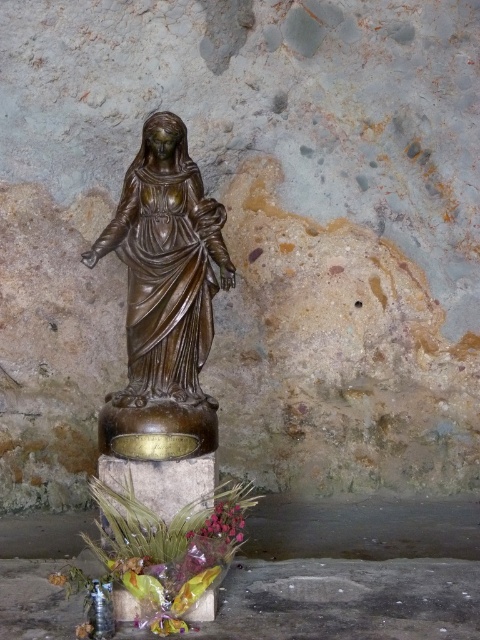
You are a maintenance worker inspecting the statue. You notice the bronze statue at center and pink matte petals at lower center. Which object is positioned higher in the scene?

The bronze statue at center is located above the pink matte petals at lower center, so it is positioned higher in the scene.

You are standing in front of the bronze statue and want to place two markers at the points labeled point (144, 396) and point (224, 512). If you look from your current position, which point is closer to the front of the statue?

Point (224, 512) is closer to the front of the statue because it is in front of point (144, 396).

You are standing in front of the bronze statue at center and want to place a small bouquet of flowers near the pink matte petals at lower center. Since you can only move forward or backward, will you need to move closer to the statue or step back to reach the petals?

The bronze statue at center is further to the viewer than pink matte petals at lower center, so you need to step back to reach the petals.